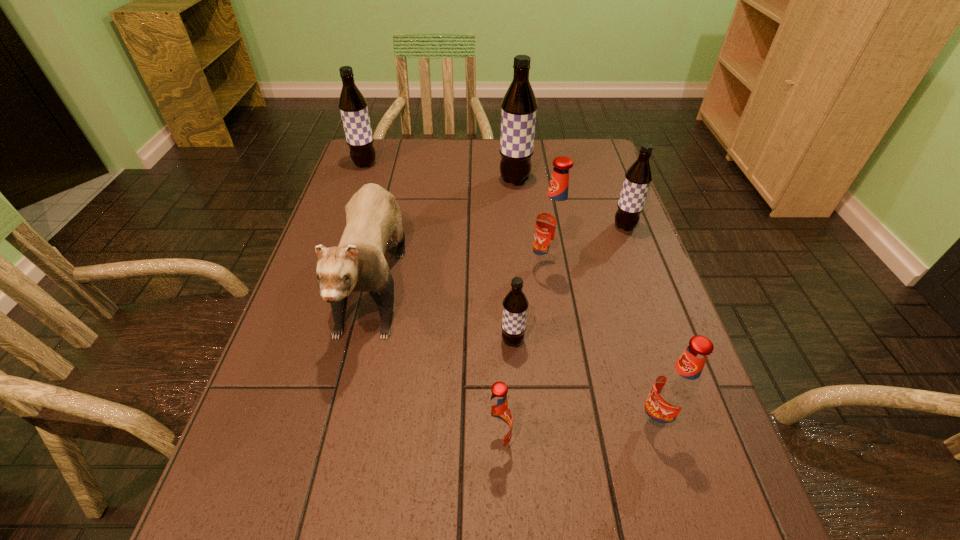
Locate an element on the screen. This screenshot has height=540, width=960. root beer that stands as the fourth closest to the nearest brown root beer is located at coordinates (638, 177).

Identify which root beer is located as the fourth nearest to the rightmost root beer. Please provide its 2D coordinates. Your answer should be formatted as a tuple, i.e. [(x, y)], where the tuple contains the x and y coordinates of a point satisfying the conditions above.

[(675, 391)]

You are a GUI agent. You are given a task and a screenshot of the screen. Output one action in this format:
    pyautogui.click(x=<x>, y=<y>)
    Task: Click on the brown root beer identified as the closest to the sixth root beer from left to right
    
    Given the screenshot: What is the action you would take?
    515,304

Select which brown root beer is the closest to the third biggest brown root beer. Please provide its 2D coordinates. Your answer should be formatted as a tuple, i.e. [(x, y)], where the tuple contains the x and y coordinates of a point satisfying the conditions above.

[(519, 106)]

Locate which red root beer is the closest to the leftmost red root beer. Please provide its 2D coordinates. Your answer should be formatted as a tuple, i.e. [(x, y)], where the tuple contains the x and y coordinates of a point satisfying the conditions above.

[(675, 391)]

In order to click on red root beer that is the second closest to the farthest root beer in this screenshot , I will do `click(498, 418)`.

You are a GUI agent. You are given a task and a screenshot of the screen. Output one action in this format:
    pyautogui.click(x=<x>, y=<y>)
    Task: Click on the vacant space that satisfies the following two spatial constraints: 1. on the back side of the smallest red root beer; 2. on the left side of the third farthest brown root beer
    The width and height of the screenshot is (960, 540).
    Given the screenshot: What is the action you would take?
    pyautogui.click(x=491, y=226)

The width and height of the screenshot is (960, 540). In order to click on vacant space that satisfies the following two spatial constraints: 1. on the front side of the leftmost root beer; 2. on the right side of the smallest brown root beer in this screenshot , I will do `click(303, 341)`.

Where is `free space that satisfies the following two spatial constraints: 1. on the face of the ferret; 2. on the left side of the smallest brown root beer`? The height and width of the screenshot is (540, 960). free space that satisfies the following two spatial constraints: 1. on the face of the ferret; 2. on the left side of the smallest brown root beer is located at coordinates (360, 341).